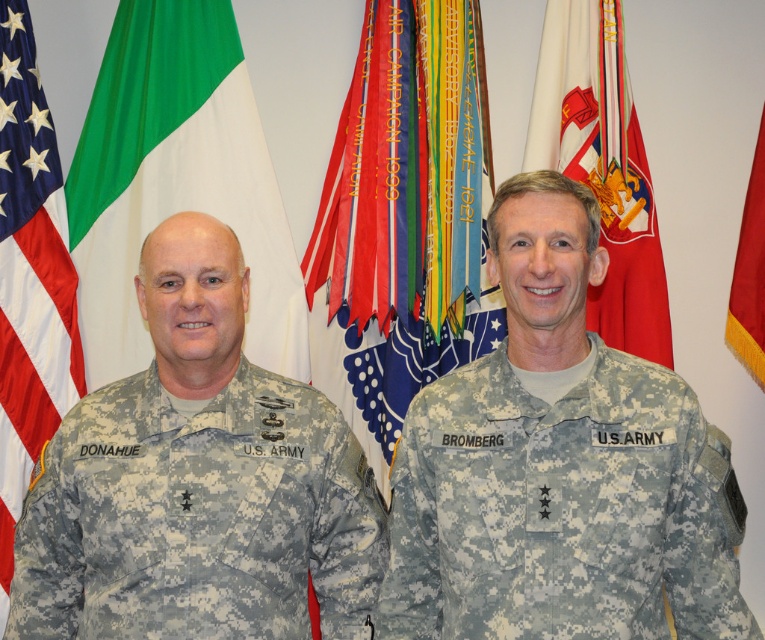
Question: Which of the following is the farthest from the observer?

Choices:
 (A) camouflage fabric uniform at right
 (B) american flag at left

Answer: (B)

Question: Among these points, which one is nearest to the camera?

Choices:
 (A) (402, 522)
 (B) (759, 346)
 (C) (86, 196)

Answer: (A)

Question: Is camouflage fabric uniform at left wider than red fabric flag at right?

Choices:
 (A) no
 (B) yes

Answer: (B)

Question: Does camouflage fabric uniform at right appear on the left side of american flag at left?

Choices:
 (A) no
 (B) yes

Answer: (A)

Question: Is multicolored ribbons at center in front of green fabric flag at left?

Choices:
 (A) yes
 (B) no

Answer: (B)

Question: Estimate the real-world distances between objects in this image. Which object is farther from the red fabric flag at center?

Choices:
 (A) multicolored ribbons at center
 (B) camouflage fabric uniform at right
 (C) american flag at left
 (D) red fabric flag at right

Answer: (C)